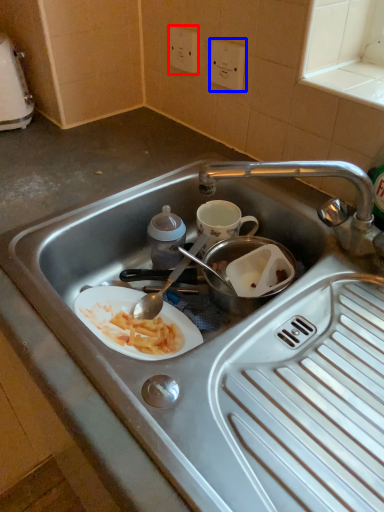
Question: Which point is further to the camera, electric outlet (highlighted by a red box) or electric outlet (highlighted by a blue box)?

Choices:
 (A) electric outlet
 (B) electric outlet

Answer: (A)